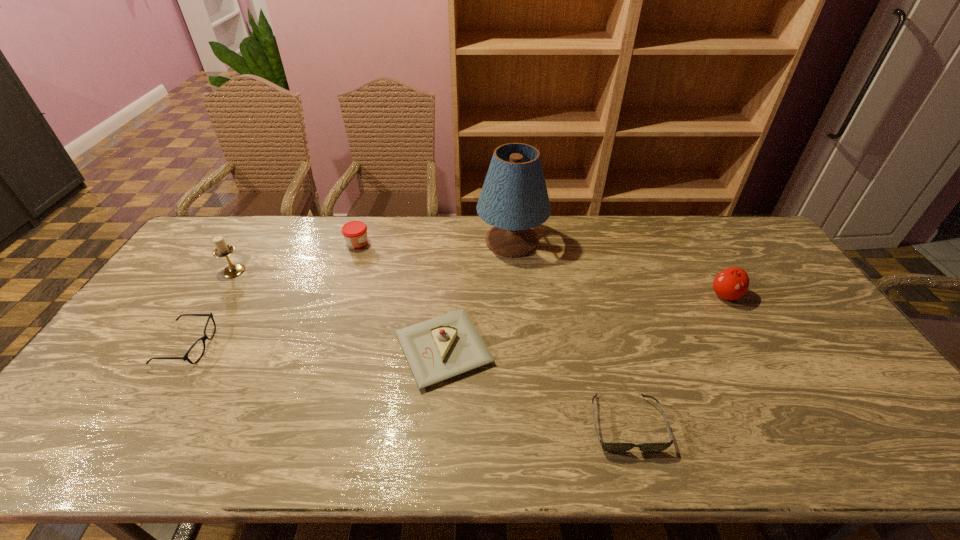
The height and width of the screenshot is (540, 960). What are the coordinates of `free spot located on the right of the sixth shortest object` in the screenshot? It's located at (305, 271).

What are the coordinates of `free space located on the front of the fourth nearest object` in the screenshot? It's located at (769, 370).

Identify the location of vacant area situated on the label side of the fifth object from right to left. The image size is (960, 540). (452, 244).

I want to click on free spot located on the front of the cake, so click(x=439, y=421).

Find the location of a particular element. vacant space located on the front-facing side of the spectacles is located at coordinates (245, 346).

The height and width of the screenshot is (540, 960). In order to click on lampshade that is at the far edge in this screenshot , I will do `click(514, 198)`.

This screenshot has width=960, height=540. Find the location of `jam present at the far edge`. jam present at the far edge is located at coordinates (355, 232).

Identify the location of object present at the near edge. The image size is (960, 540). (610, 447).

In order to click on candle holder that is at the left edge in this screenshot , I will do `click(222, 250)`.

At what (x,y) coordinates should I click in order to perform the action: click on spectacles present at the left edge. Please return your answer as a coordinate pair (x, y). The image size is (960, 540). Looking at the image, I should click on (205, 337).